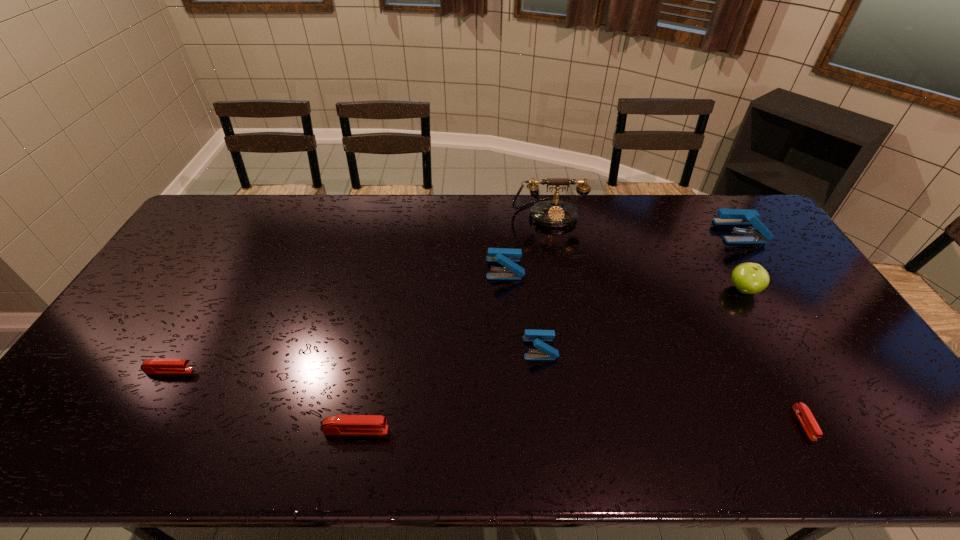
The height and width of the screenshot is (540, 960). In the image, there is a desktop. In order to click on free space at the left edge in this screenshot , I will do `click(102, 395)`.

Find the location of `vacant area at the right edge of the desktop`. vacant area at the right edge of the desktop is located at coordinates (849, 350).

Find the location of a particular element. vacant space at the far left corner is located at coordinates (216, 206).

At what (x,y) coordinates should I click in order to perform the action: click on vacant space at the far right corner. Please return your answer as a coordinate pair (x, y). The image size is (960, 540). Looking at the image, I should click on (735, 226).

At what (x,y) coordinates should I click in order to perform the action: click on vacant space that's between the second nearest blue stapler and the second object from left to right. Please return your answer as a coordinate pair (x, y). Image resolution: width=960 pixels, height=540 pixels. Looking at the image, I should click on (431, 349).

You are a GUI agent. You are given a task and a screenshot of the screen. Output one action in this format:
    pyautogui.click(x=<x>, y=<y>)
    Task: Click on the empty space between the sixth tallest object and the second smallest blue stapler
    This screenshot has height=540, width=960.
    Given the screenshot: What is the action you would take?
    pyautogui.click(x=431, y=349)

Find the location of `empty space that is in between the third shortest stapler and the rightmost red stapler`. empty space that is in between the third shortest stapler and the rightmost red stapler is located at coordinates (580, 427).

I want to click on free point between the leftmost stapler and the black telephone, so click(x=359, y=292).

Image resolution: width=960 pixels, height=540 pixels. In order to click on free area in between the third farthest stapler and the biggest red stapler in this screenshot , I will do `click(448, 389)`.

Find the location of `free spot between the sixth farthest object and the fourth nearest object`. free spot between the sixth farthest object and the fourth nearest object is located at coordinates pyautogui.click(x=355, y=359).